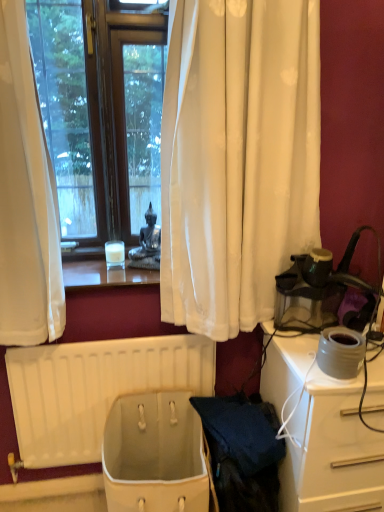
Question: Is matte gray pot at right inside or outside of white fabric basket at lower center?

Choices:
 (A) outside
 (B) inside

Answer: (A)

Question: From the image's perspective, is matte gray pot at right above or below white fabric basket at lower center?

Choices:
 (A) below
 (B) above

Answer: (B)

Question: Which object is the farthest from the white plastic radiator at lower center?

Choices:
 (A) translucent glass candle at center
 (B) matte gray pot at right
 (C) white glossy desk at right
 (D) white fabric basket at lower center

Answer: (B)

Question: Which object is the farthest from the white glossy desk at right?

Choices:
 (A) matte gray pot at right
 (B) white plastic radiator at lower center
 (C) white fabric basket at lower center
 (D) translucent glass candle at center

Answer: (D)